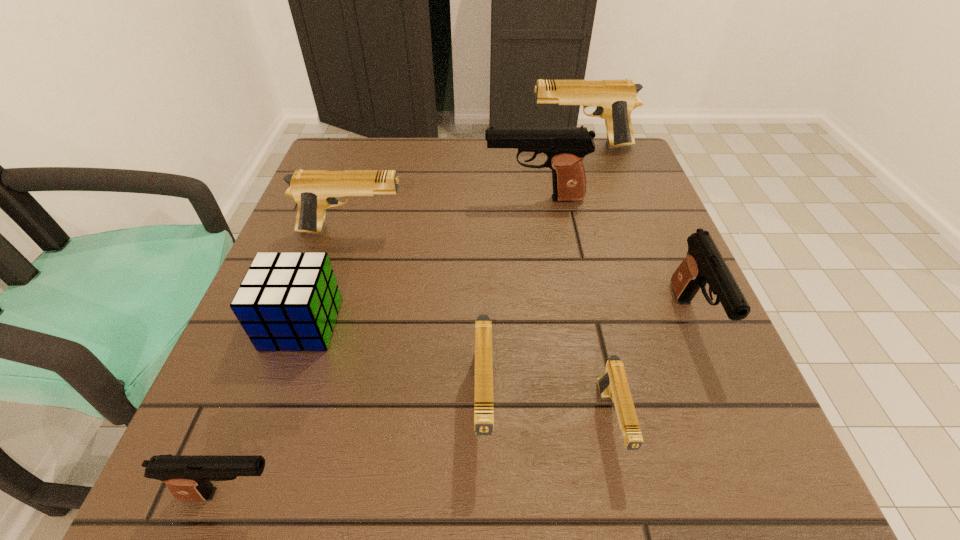
Identify the location of tan pistol identified as the second closest to the third tan pistol from right to left. tap(314, 190).

In order to click on vacant area that satisfies the following two spatial constraints: 1. at the barrel of the third tan pistol from right to left; 2. at the barrel of the nearest pistol in this screenshot , I will do `click(484, 494)`.

At what (x,y) coordinates should I click in order to perform the action: click on vacant region that satisfies the following two spatial constraints: 1. at the barrel of the farthest pistol; 2. at the barrel of the second smallest tan pistol. Please return your answer as a coordinate pair (x, y). Looking at the image, I should click on (661, 403).